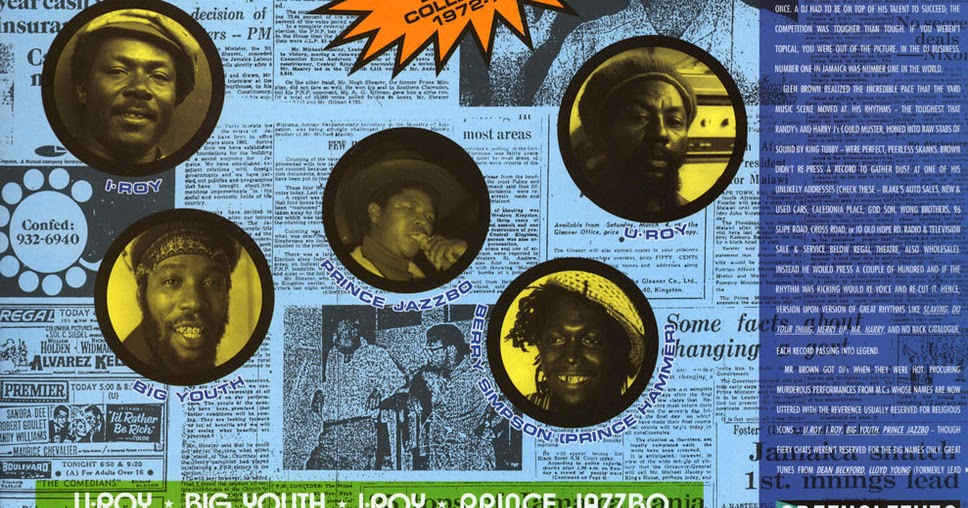
You are a GUI agent. You are given a task and a screenshot of the screen. Output one action in this format:
    pyautogui.click(x=<x>, y=<y>)
    Task: Click on the pictures
    The width and height of the screenshot is (968, 508).
    Given the screenshot: What is the action you would take?
    pyautogui.click(x=378, y=407)